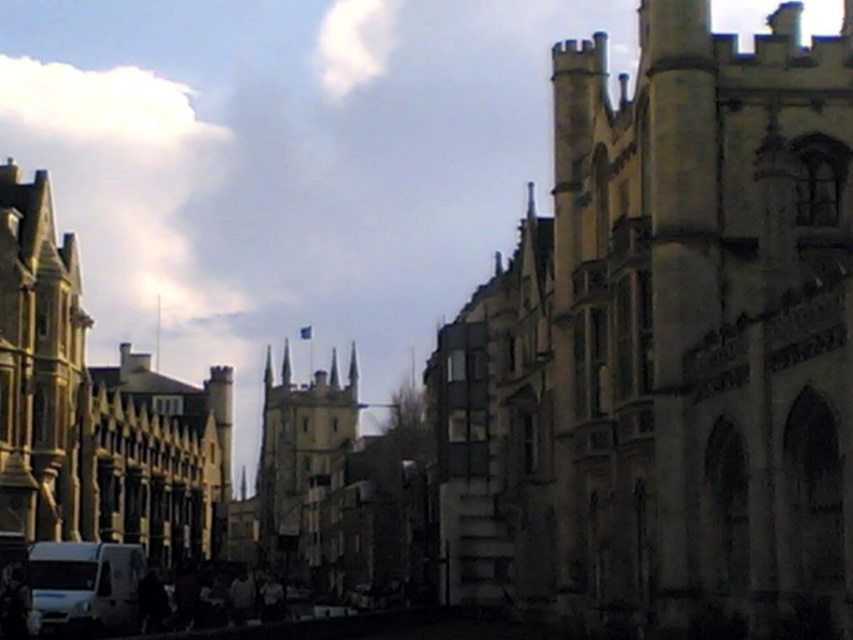
You are a tour guide explaining the landmarks in Oxford to a group. You point out the stone spire at center and the white matte van at lower left. Which object is bigger in the scene?

The stone spire at center is larger than the white matte van at lower left according to the description.

You are standing at the entrance of the street scene in Oxford. You want to take a photo of the stone spire at center. Which direction should you face to capture it in your camera view?

The stone spire at center is located at point coordinates, so you should face towards the center of the scene to capture it in your photo.

You are standing at the point closest to the right side of the street and want to walk straight ahead. Will the point you are currently standing at, point (70, 628), be visible to someone standing at point (260, 476)?

Point (260, 476) is behind point (70, 628), so someone standing at point (260, 476) would not be able to see point (70, 628) because it is obscured by the buildings or structures in between.